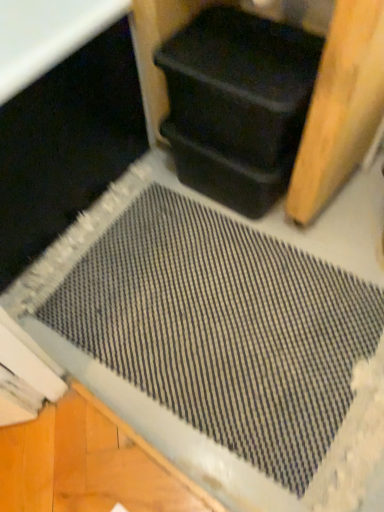
Question: From the image's perspective, is black plastic container at upper center on top of black plastic container at upper right?

Choices:
 (A) yes
 (B) no

Answer: (A)

Question: Is the surface of black plastic container at upper center in direct contact with black plastic container at upper right?

Choices:
 (A) yes
 (B) no

Answer: (A)

Question: Is black plastic container at upper center positioned in front of black plastic container at upper right?

Choices:
 (A) no
 (B) yes

Answer: (B)

Question: Is black plastic container at upper center wider than black plastic container at upper right?

Choices:
 (A) no
 (B) yes

Answer: (B)

Question: From a real-world perspective, is black plastic container at upper center beneath black plastic container at upper right?

Choices:
 (A) no
 (B) yes

Answer: (B)

Question: From a real-world perspective, is black plastic container at upper center positioned over black plastic container at upper right based on gravity?

Choices:
 (A) no
 (B) yes

Answer: (A)

Question: From the image's perspective, does black plastic container at upper right appear lower than black plastic container at upper center?

Choices:
 (A) yes
 (B) no

Answer: (A)

Question: Is black plastic container at upper right closer to the viewer compared to black plastic container at upper center?

Choices:
 (A) yes
 (B) no

Answer: (B)

Question: Can you confirm if black plastic container at upper right is positioned to the right of black plastic container at upper center?

Choices:
 (A) yes
 (B) no

Answer: (B)

Question: From a real-world perspective, is black plastic container at upper right over black plastic container at upper center?

Choices:
 (A) no
 (B) yes

Answer: (B)

Question: Does black plastic container at upper right have a larger size compared to black plastic container at upper center?

Choices:
 (A) yes
 (B) no

Answer: (B)

Question: From the image's perspective, is black plastic container at upper right above black plastic container at upper center?

Choices:
 (A) yes
 (B) no

Answer: (B)

Question: In the image, is black plastic container at upper center on the left side or the right side of black plastic container at upper right?

Choices:
 (A) right
 (B) left

Answer: (A)